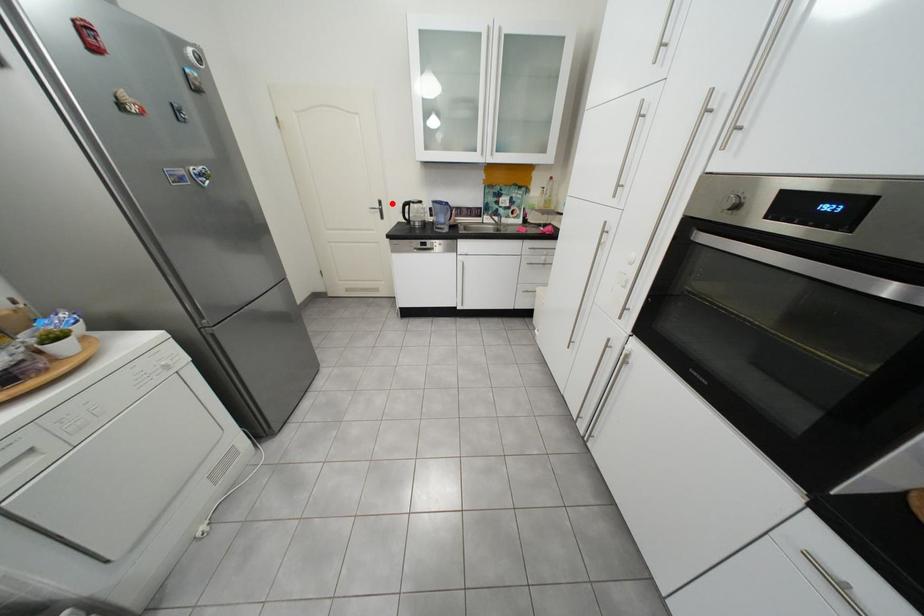
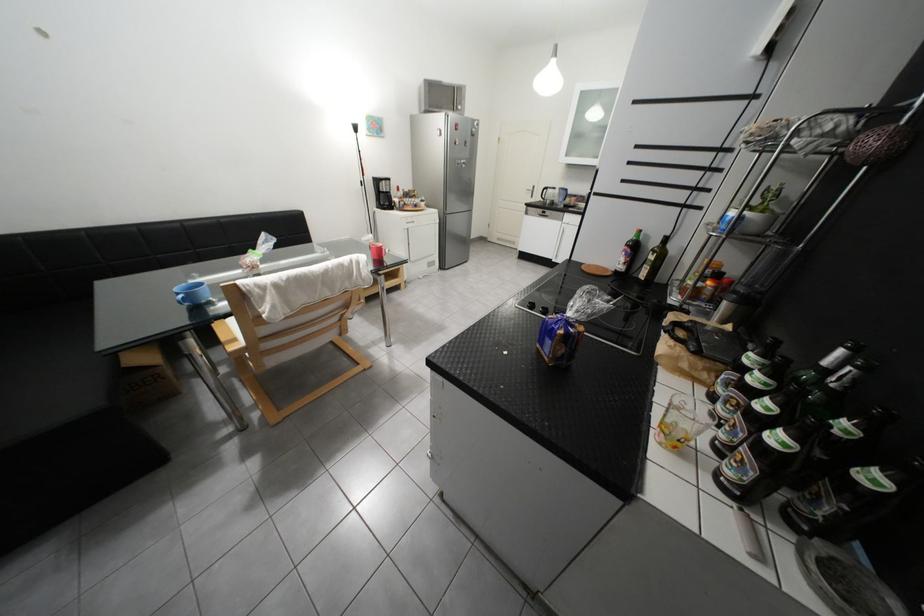
Where in the second image is the point corresponding to the highlighted location from the first image?

(545, 188)